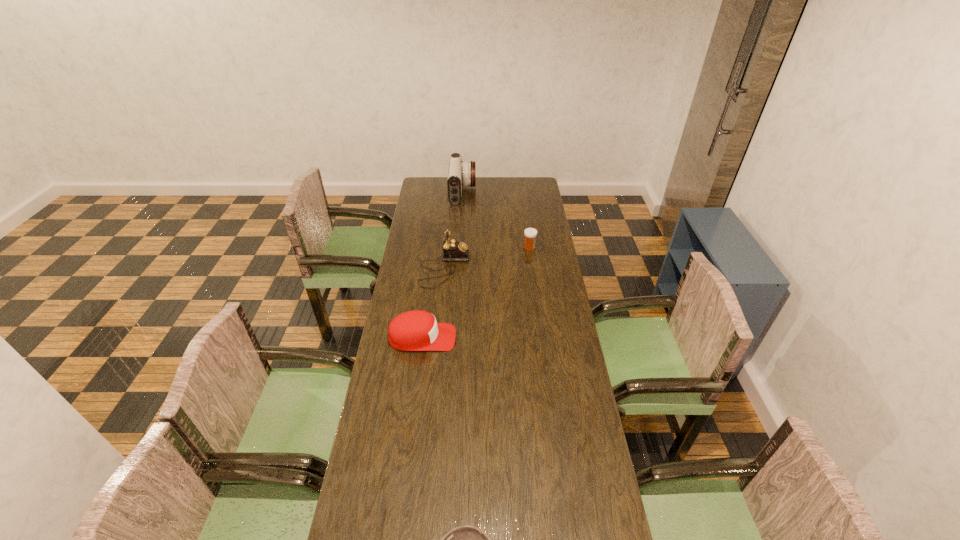
What are the coordinates of `vacant area that lies between the second nearest object and the rightmost object` in the screenshot? It's located at (476, 293).

Identify the location of object that is the third nearest to the telephone. The image size is (960, 540). (461, 173).

The image size is (960, 540). Find the location of `object that stands as the closest to the camcorder`. object that stands as the closest to the camcorder is located at coordinates (453, 250).

I want to click on free space in the image that satisfies the following two spatial constraints: 1. on the surface of the medicine; 2. on the right side of the camcorder, so click(x=459, y=248).